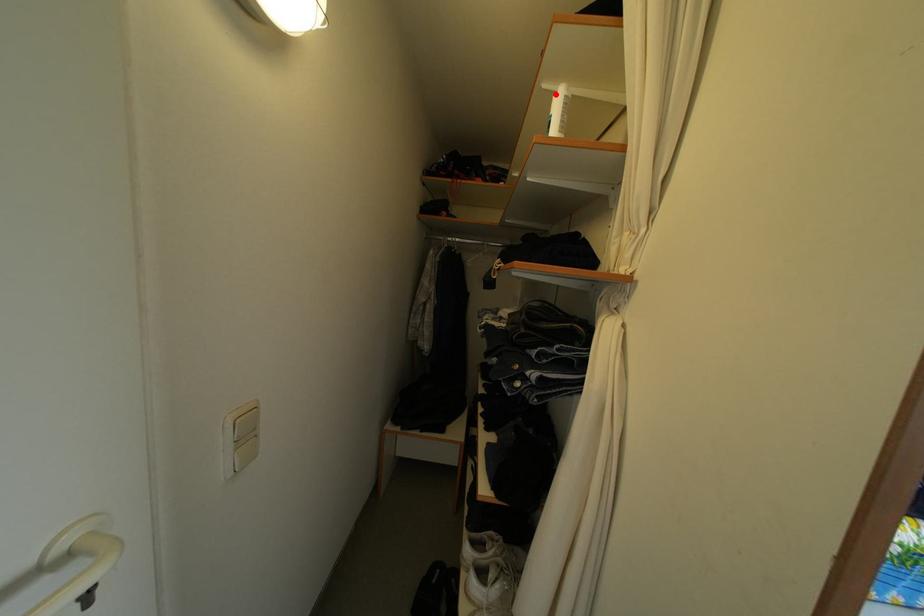
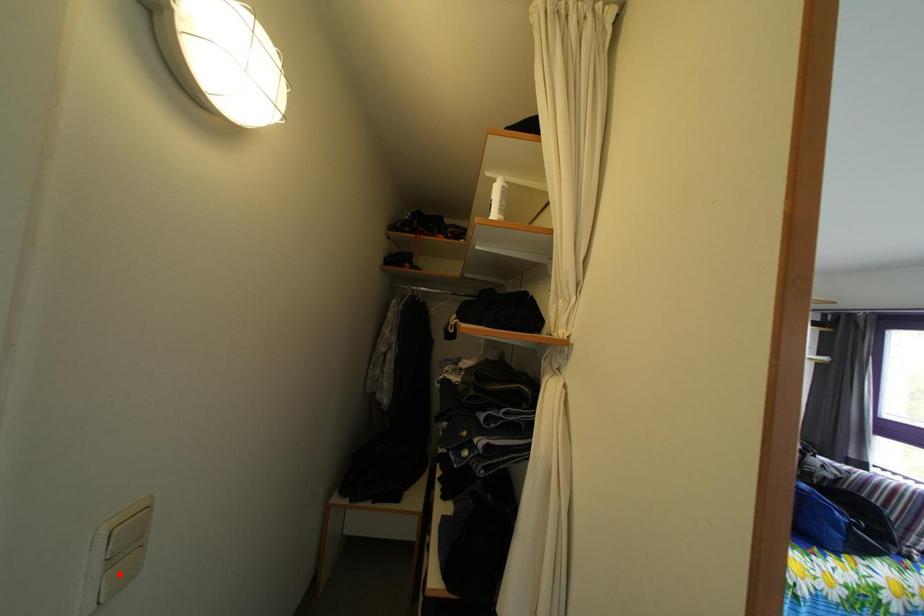
I am providing you with two images of the same scene from different viewpoints. A red point is marked on the first image and another point is marked on the second image. Is the marked point in image1 the same physical position as the marked point in image2?

No